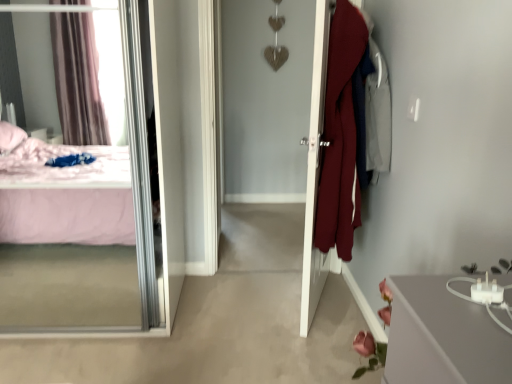
At what (x,y) coordinates should I click in order to perform the action: click on free point below white glossy door at center (from a real-world perspective). Please return your answer as a coordinate pair (x, y). The image size is (512, 384). Looking at the image, I should click on point(316,302).